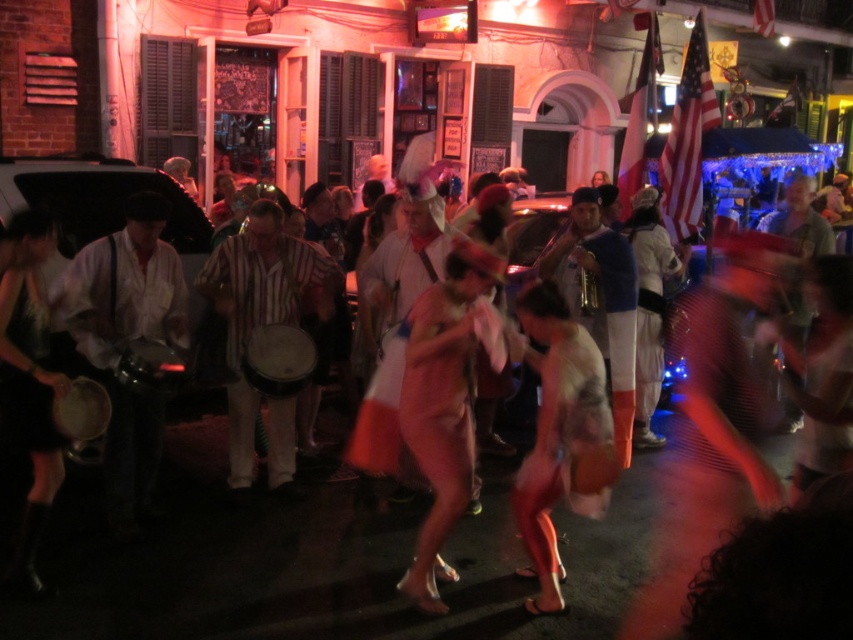
Question: Which of the following is the farthest from the observer?

Choices:
 (A) shiny metallic dress at center
 (B) striped fabric drum at center
 (C) smooth wooden drum at center

Answer: (B)

Question: Is pink satin dress at center to the left of shiny metallic dress at center from the viewer's perspective?

Choices:
 (A) no
 (B) yes

Answer: (B)

Question: Which is farther from the pink satin dress at center?

Choices:
 (A) striped fabric drum at center
 (B) smooth wooden drum at center
 (C) shiny metallic dress at center

Answer: (A)

Question: Which point is closer to the camera?

Choices:
 (A) black leather dress at left
 (B) pink satin dress at center
 (C) striped fabric drum at center

Answer: (A)

Question: Is striped fabric drum at center below smooth wooden drum at center?

Choices:
 (A) no
 (B) yes

Answer: (A)

Question: Is black leather dress at left bigger than smooth wooden drum at center?

Choices:
 (A) yes
 (B) no

Answer: (A)